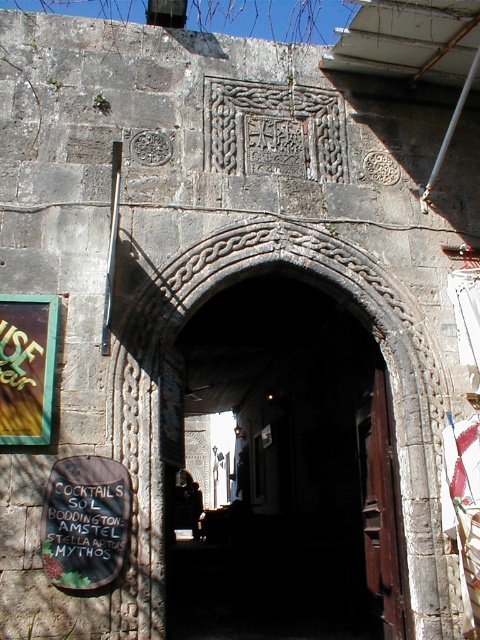
Is point (108, 502) positioned in front of point (10, 294)?

Yes, it is in front of point (10, 294).

Between point (95, 499) and point (36, 332), which one is positioned behind?

Positioned behind is point (36, 332).

Does point (123, 525) lie behind point (48, 376)?

That is False.

I want to click on black paper sign at center, so click(x=85, y=522).

The image size is (480, 640). What do you see at coordinates (289, 472) in the screenshot?
I see `dark stone archway at center` at bounding box center [289, 472].

The height and width of the screenshot is (640, 480). I want to click on dark stone archway at center, so click(x=289, y=472).

Which is in front, point (368, 461) or point (48, 497)?

Point (48, 497)

Find the location of a particular element. The width and height of the screenshot is (480, 640). dark stone archway at center is located at coordinates (289, 472).

Can you confirm if dark stone archway at center is shorter than green glass sign at left?

Correct, dark stone archway at center is not as tall as green glass sign at left.

Where is `dark stone archway at center`? dark stone archway at center is located at coordinates (289, 472).

The image size is (480, 640). What do you see at coordinates (289, 472) in the screenshot?
I see `dark stone archway at center` at bounding box center [289, 472].

Where is `dark stone archway at center`? The height and width of the screenshot is (640, 480). dark stone archway at center is located at coordinates (289, 472).